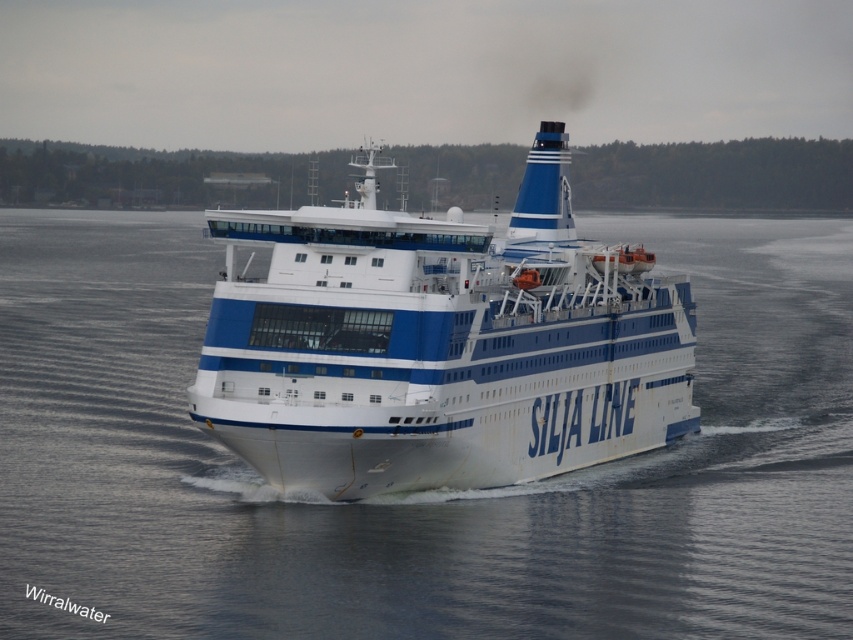
Does white water at center appear under white glossy ferry at center?

Yes.

Is white water at center in front of white glossy ferry at center?

Yes, white water at center is closer to the viewer.

This screenshot has width=853, height=640. Find the location of `white water at center`. white water at center is located at coordinates (421, 492).

What are the coordinates of `white water at center` in the screenshot? It's located at (421, 492).